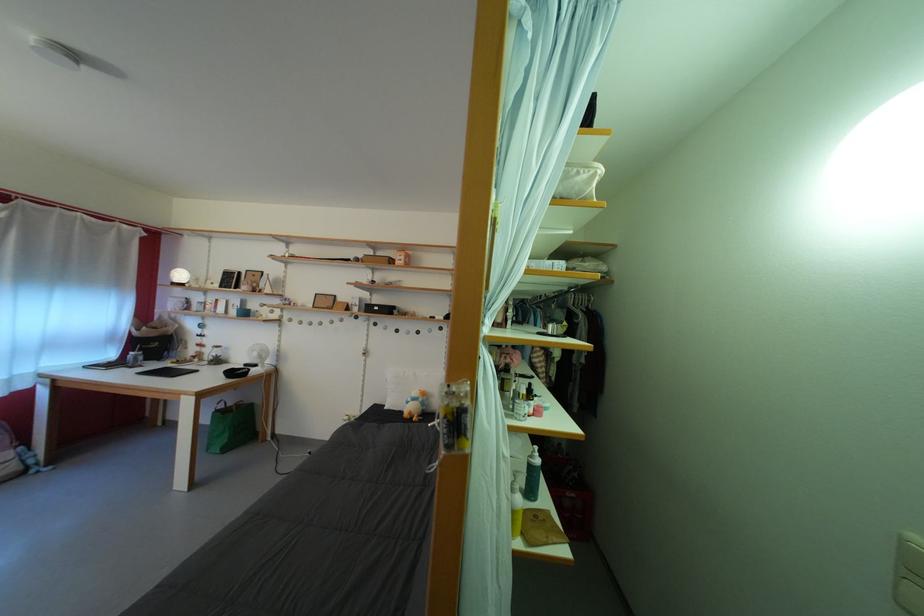
Find the location of a particular element. This screenshot has height=616, width=924. battery pack switch is located at coordinates (908, 573).